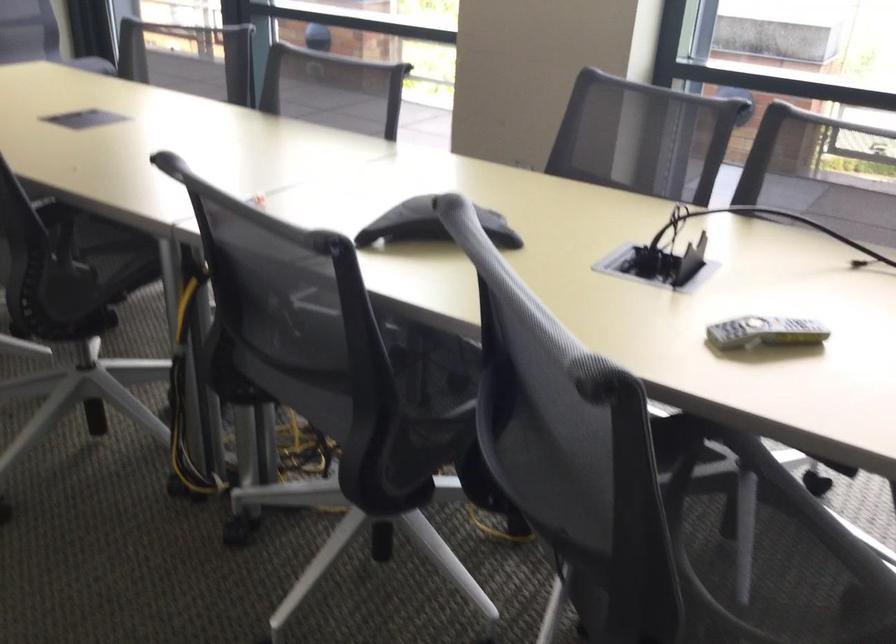
Where would you lift the grey remote control? Please return your answer as a coordinate pair (x, y).

(764, 332)